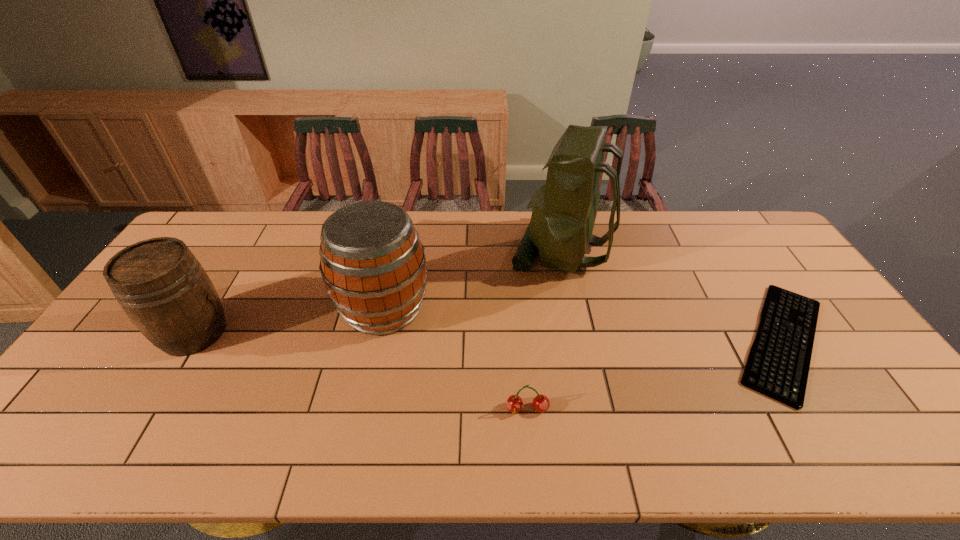
Find the location of `vacant region between the right cider and the fourth tallest object`. vacant region between the right cider and the fourth tallest object is located at coordinates (455, 359).

At what (x,y) coordinates should I click in order to perform the action: click on free spot between the right cider and the tallest object. Please return your answer as a coordinate pair (x, y). The width and height of the screenshot is (960, 540). Looking at the image, I should click on (472, 279).

Image resolution: width=960 pixels, height=540 pixels. What are the coordinates of `empty space that is in between the cherry and the rightmost object` in the screenshot? It's located at (655, 375).

Locate an element on the screen. The width and height of the screenshot is (960, 540). object that is the closest to the shorter cider is located at coordinates point(372,262).

The image size is (960, 540). In order to click on object that stands as the third closest to the right cider in this screenshot , I will do `click(163, 289)`.

This screenshot has width=960, height=540. I want to click on free spot that satisfies the following two spatial constraints: 1. on the back side of the rightmost object; 2. on the front of the tallest object with visible pockets, so click(x=724, y=249).

Locate an element on the screen. free space that satisfies the following two spatial constraints: 1. on the front of the tallest object with visible pockets; 2. on the back side of the computer keyboard is located at coordinates (581, 341).

Find the location of a particular element. This screenshot has width=960, height=540. free spot that satisfies the following two spatial constraints: 1. on the front of the backpack with visible pockets; 2. with stems pointing upwards on the cherry is located at coordinates (595, 409).